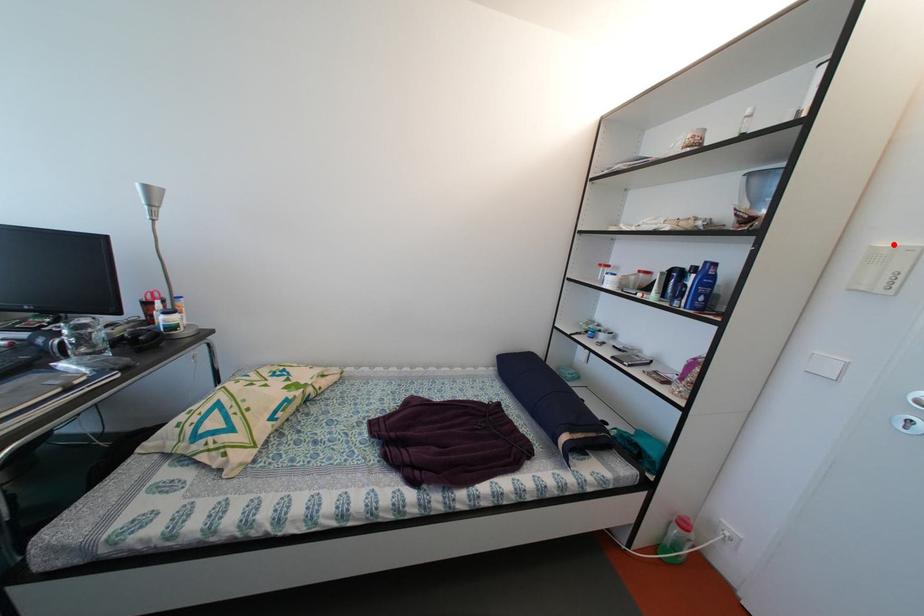
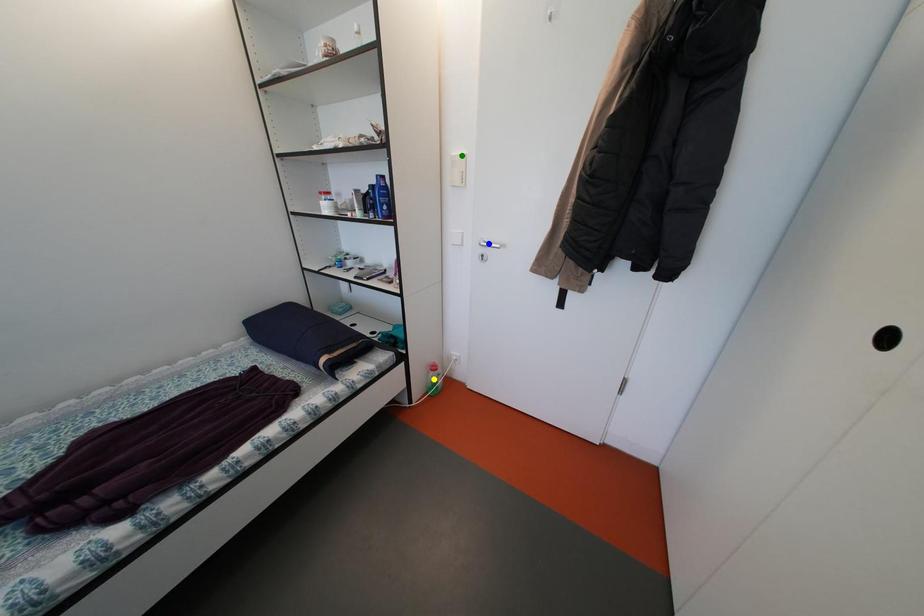
Question: I am providing you with two images of the same scene from different viewpoints. A red point is marked on the first image. You are given multiple points on the second image. Which mark in image 2 goes with the point in image 1?

Choices:
 (A) blue point
 (B) yellow point
 (C) green point

Answer: (C)